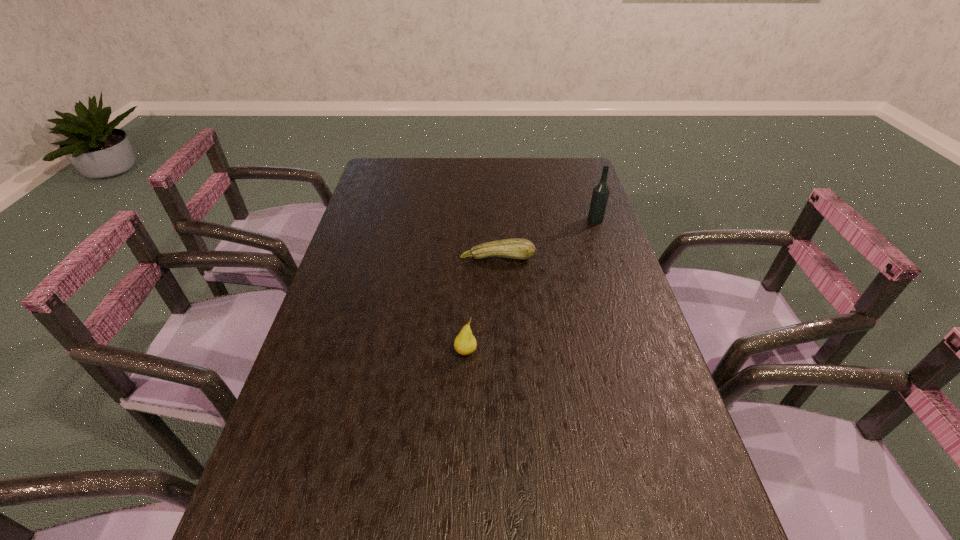
At what (x,y) coordinates should I click in order to perform the action: click on the second closest object to the tallest object. Please return your answer as a coordinate pair (x, y). The image size is (960, 540). Looking at the image, I should click on (465, 343).